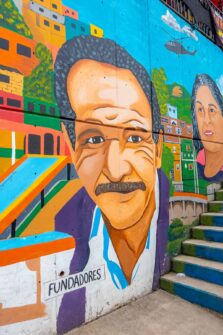
What are the coordinates of `stairs` in the screenshot? It's located at (199, 283).